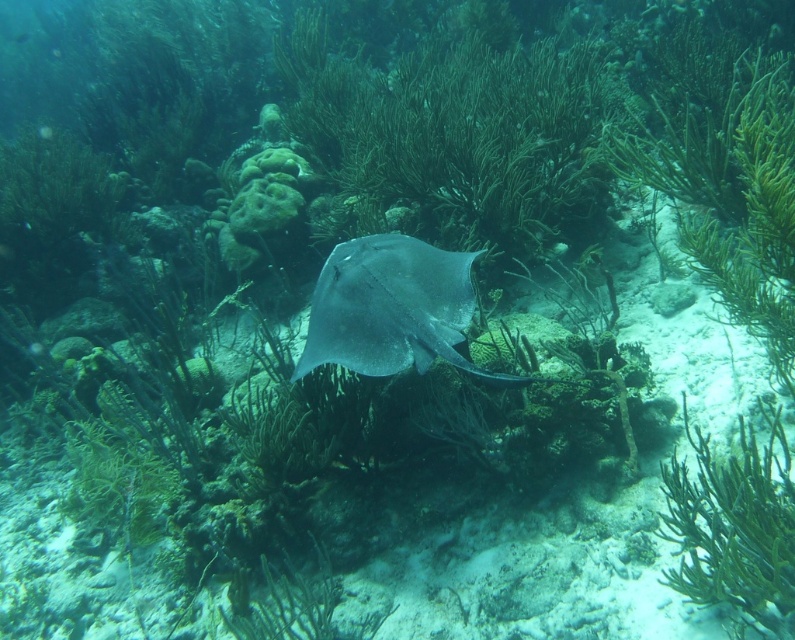
Question: Which point is closer to the camera?

Choices:
 (A) green matte algae at center
 (B) smooth gray stingray at center
 (C) green soft coral at center

Answer: (C)

Question: Can you confirm if green matte algae at center is positioned below green soft coral at center?

Choices:
 (A) yes
 (B) no

Answer: (B)

Question: Is green soft coral at center below smooth gray stingray at center?

Choices:
 (A) yes
 (B) no

Answer: (A)

Question: Which of the following is the closest to the observer?

Choices:
 (A) (784, 595)
 (B) (444, 252)
 (C) (578, 97)

Answer: (A)

Question: Can you confirm if green matte algae at center is smaller than green soft coral at center?

Choices:
 (A) yes
 (B) no

Answer: (B)

Question: Which object is the farthest from the smooth gray stingray at center?

Choices:
 (A) green matte algae at center
 (B) green soft coral at center

Answer: (A)